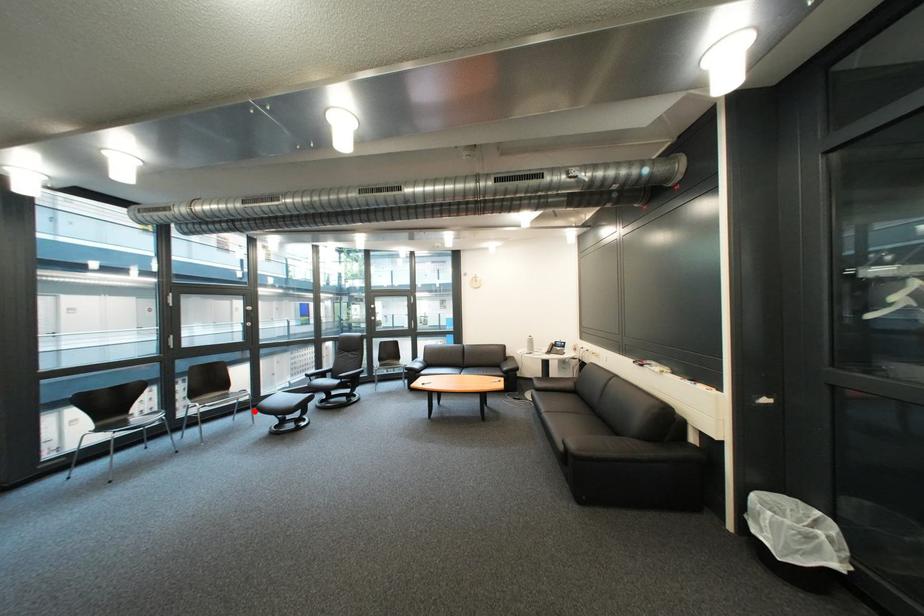
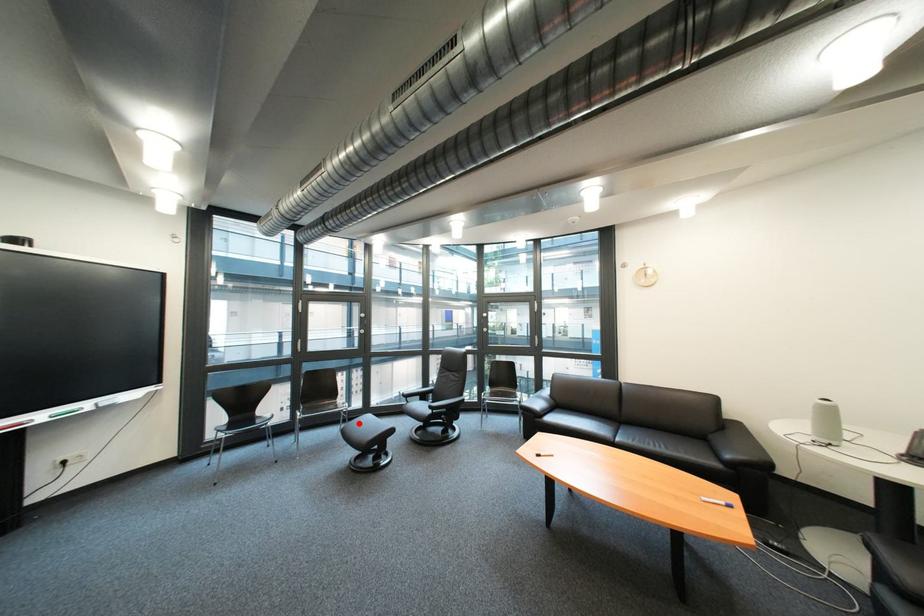
I am providing you with two images of the same scene from different viewpoints. A red point is marked on the first image and another point is marked on the second image. Do the highlighted points in image1 and image2 indicate the same real-world spot?

Yes